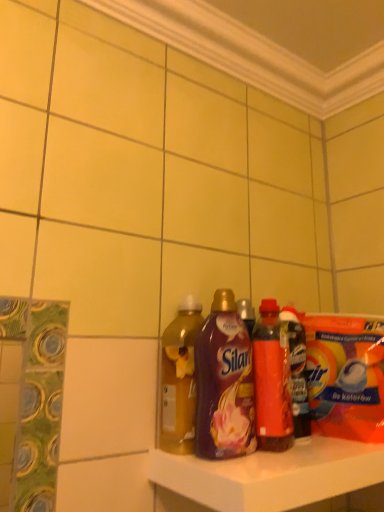
Question: From a real-world perspective, is purple plastic bottle at center, which ranks as the 3th bottle in right-to-left order, over translucent plastic bottle at center, placed as the 1th bottle when sorted from right to left?

Choices:
 (A) no
 (B) yes

Answer: (B)

Question: Is the surface of purple plastic bottle at center, which ranks as the 3th bottle in right-to-left order, in direct contact with translucent plastic bottle at center, which is counted as the 4th bottle, starting from the left?

Choices:
 (A) yes
 (B) no

Answer: (B)

Question: Would you say purple plastic bottle at center, which ranks as the 3th bottle in right-to-left order, contains translucent plastic bottle at center, which is counted as the 4th bottle, starting from the left?

Choices:
 (A) yes
 (B) no

Answer: (B)

Question: Does purple plastic bottle at center, the second bottle in the left-to-right sequence, turn towards translucent plastic bottle at center, placed as the 1th bottle when sorted from right to left?

Choices:
 (A) no
 (B) yes

Answer: (A)

Question: Considering the relative positions of purple plastic bottle at center, which ranks as the 3th bottle in right-to-left order, and translucent plastic bottle at center, which is counted as the 4th bottle, starting from the left, in the image provided, is purple plastic bottle at center, which ranks as the 3th bottle in right-to-left order, to the left of translucent plastic bottle at center, which is counted as the 4th bottle, starting from the left, from the viewer's perspective?

Choices:
 (A) yes
 (B) no

Answer: (A)

Question: Can you confirm if purple plastic bottle at center, the second bottle in the left-to-right sequence, is smaller than translucent plastic bottle at center, which is counted as the 4th bottle, starting from the left?

Choices:
 (A) no
 (B) yes

Answer: (A)

Question: Is translucent yellow liquid at center, arranged as the 4th bottle when viewed from the right, at the back of translucent plastic bottle at center, which is counted as the 4th bottle, starting from the left?

Choices:
 (A) yes
 (B) no

Answer: (B)

Question: Can you confirm if translucent plastic bottle at center, placed as the 1th bottle when sorted from right to left, is bigger than translucent yellow liquid at center, placed as the first bottle when sorted from left to right?

Choices:
 (A) no
 (B) yes

Answer: (A)

Question: Is there a large distance between translucent plastic bottle at center, which is counted as the 4th bottle, starting from the left, and translucent yellow liquid at center, placed as the first bottle when sorted from left to right?

Choices:
 (A) yes
 (B) no

Answer: (B)

Question: Is translucent plastic bottle at center, placed as the 1th bottle when sorted from right to left, at the left side of translucent yellow liquid at center, arranged as the 4th bottle when viewed from the right?

Choices:
 (A) no
 (B) yes

Answer: (A)

Question: Does translucent plastic bottle at center, placed as the 1th bottle when sorted from right to left, have a lesser width compared to translucent yellow liquid at center, arranged as the 4th bottle when viewed from the right?

Choices:
 (A) yes
 (B) no

Answer: (A)

Question: Does translucent plastic bottle at center, which is counted as the 4th bottle, starting from the left, have a greater width compared to translucent yellow liquid at center, arranged as the 4th bottle when viewed from the right?

Choices:
 (A) no
 (B) yes

Answer: (A)

Question: Is translucent plastic bottle at center, which is counted as the 4th bottle, starting from the left, to the right of purple plastic bottle at center, which ranks as the 3th bottle in right-to-left order, from the viewer's perspective?

Choices:
 (A) no
 (B) yes

Answer: (B)